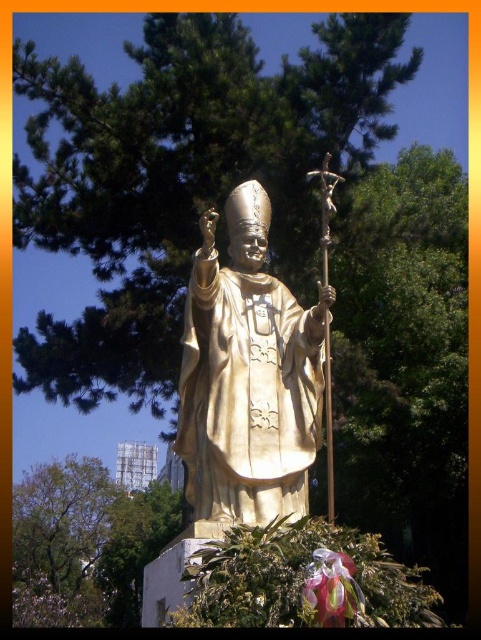
You are a gardener who wants to place a new flower pot near the gold polished statue at center and the translucent pink petal at lower center. Since the statue is taller, where should you place the flower pot so it won

The gold polished statue at center is taller than the translucent pink petal at lower center. To place the flower pot appropriately, position it near the base of the statue where there is space between the pedestal and the surrounding greenery, ensuring it doesn

You are a photographer trying to capture the gold polished statue at center and the translucent pink petal at lower center in a single frame. Given that the statue is much larger than the petal, how might you position your camera to ensure both are clearly visible in the photo?

Since the gold polished statue at center is larger than the translucent pink petal at lower center, you should position the camera closer to the statue while ensuring the petal remains in the frame. This way, the statue won t overpower the smaller petal, and both can be clearly seen.